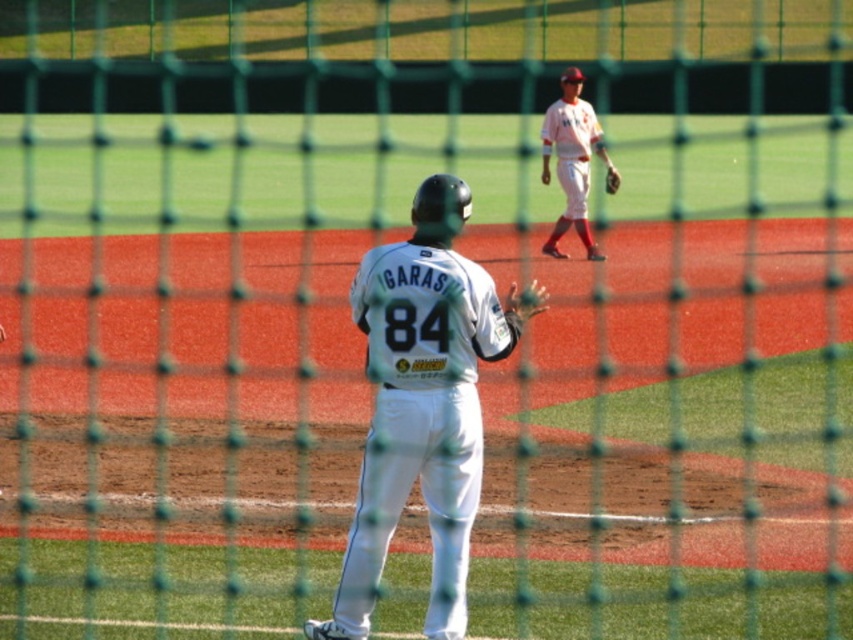
Does white matte uniform at center have a greater height compared to white uniform at upper center?

No, white matte uniform at center is not taller than white uniform at upper center.

Does white matte uniform at center have a smaller size compared to white uniform at upper center?

Yes.

Is point (479, 419) positioned in front of point (573, 148)?

Yes, it is.

This screenshot has height=640, width=853. Find the location of `white matte uniform at center`. white matte uniform at center is located at coordinates (422, 403).

Who is taller, white matte uniform at center or brown leather glove at center?

With more height is white matte uniform at center.

Looking at this image, is white matte uniform at center wider than brown leather glove at center?

Indeed, white matte uniform at center has a greater width compared to brown leather glove at center.

Who is more distant from viewer, (473,502) or (618,176)?

The point (618,176) is more distant.

Image resolution: width=853 pixels, height=640 pixels. What are the coordinates of `white matte uniform at center` in the screenshot? It's located at (422, 403).

Can you confirm if white uniform at upper center is taller than brown leather glove at center?

Correct, white uniform at upper center is much taller as brown leather glove at center.

Does white uniform at upper center appear under brown leather glove at center?

No, white uniform at upper center is not below brown leather glove at center.

At what (x,y) coordinates should I click in order to perform the action: click on white uniform at upper center. Please return your answer as a coordinate pair (x, y). This screenshot has height=640, width=853. Looking at the image, I should click on (572, 160).